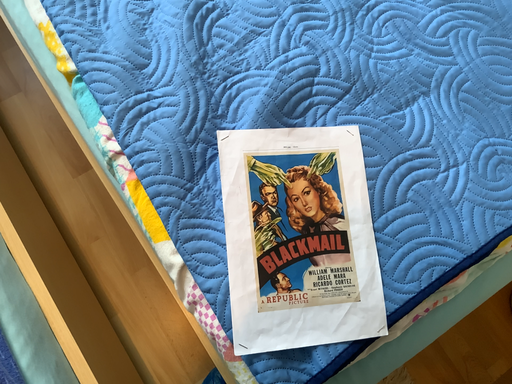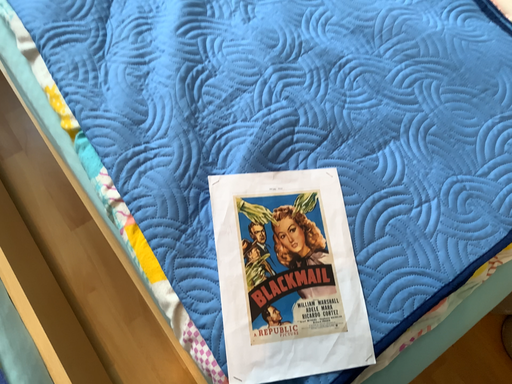
Question: How did the camera likely rotate when shooting the video?

Choices:
 (A) rotated upward
 (B) rotated downward

Answer: (A)